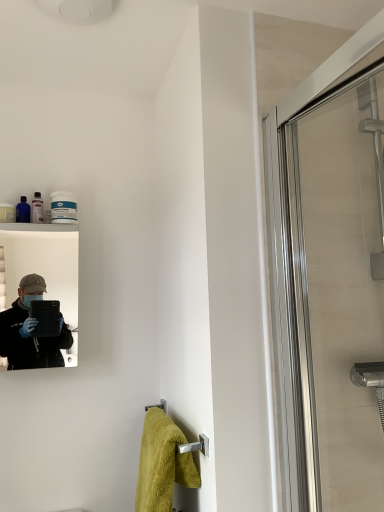
Question: Is matte black mirror at left positioned far away from soft yellow towel at lower center?

Choices:
 (A) no
 (B) yes

Answer: (A)

Question: Could you tell me if matte black mirror at left is facing soft yellow towel at lower center?

Choices:
 (A) no
 (B) yes

Answer: (A)

Question: Is matte black mirror at left further to the viewer compared to soft yellow towel at lower center?

Choices:
 (A) no
 (B) yes

Answer: (B)

Question: Is matte black mirror at left at the left side of soft yellow towel at lower center?

Choices:
 (A) yes
 (B) no

Answer: (A)

Question: Can you confirm if matte black mirror at left is shorter than soft yellow towel at lower center?

Choices:
 (A) no
 (B) yes

Answer: (A)

Question: Is matte black mirror at left to the right of soft yellow towel at lower center from the viewer's perspective?

Choices:
 (A) yes
 (B) no

Answer: (B)

Question: Does soft yellow towel at lower center appear on the left side of clear glass shower door at right?

Choices:
 (A) no
 (B) yes

Answer: (B)

Question: Considering the relative sizes of soft yellow towel at lower center and clear glass shower door at right in the image provided, is soft yellow towel at lower center wider than clear glass shower door at right?

Choices:
 (A) yes
 (B) no

Answer: (A)

Question: Does soft yellow towel at lower center come behind clear glass shower door at right?

Choices:
 (A) no
 (B) yes

Answer: (B)

Question: Does soft yellow towel at lower center turn towards clear glass shower door at right?

Choices:
 (A) yes
 (B) no

Answer: (B)

Question: Considering the relative positions of soft yellow towel at lower center and clear glass shower door at right in the image provided, is soft yellow towel at lower center to the right of clear glass shower door at right from the viewer's perspective?

Choices:
 (A) no
 (B) yes

Answer: (A)

Question: Can you confirm if soft yellow towel at lower center is smaller than clear glass shower door at right?

Choices:
 (A) yes
 (B) no

Answer: (A)

Question: From a real-world perspective, is clear glass shower door at right under soft yellow towel at lower center?

Choices:
 (A) yes
 (B) no

Answer: (B)